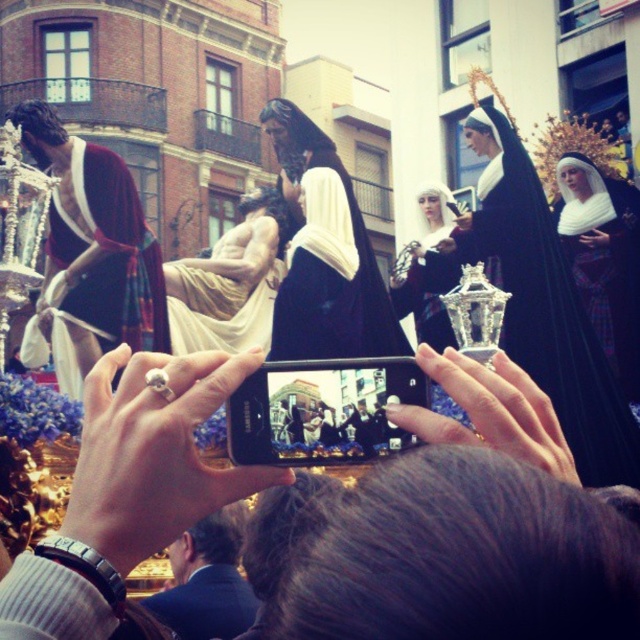
Question: Which object is closer to the camera taking this photo?

Choices:
 (A) matte black dress at center
 (B) black velvet nun at upper center

Answer: (B)

Question: Is black velvet robe at center thinner than matte black dress at center?

Choices:
 (A) no
 (B) yes

Answer: (A)

Question: Is black velvet nun at upper center wider than white woolen veil at upper right?

Choices:
 (A) no
 (B) yes

Answer: (B)

Question: Which of the following is the farthest from the observer?

Choices:
 (A) (109, 294)
 (B) (356, 323)
 (C) (611, 483)
 (D) (445, 216)

Answer: (D)

Question: Can you confirm if black velvet nun at upper center is positioned to the right of matte black dress at center?

Choices:
 (A) yes
 (B) no

Answer: (A)

Question: Which object appears closest to the camera in this image?

Choices:
 (A) black velvet robe at center
 (B) clear glass lantern at center
 (C) black velvet nun at upper center

Answer: (C)